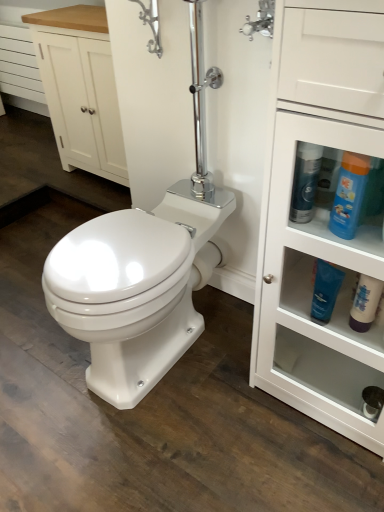
Question: From a real-world perspective, is white wood cabinet at upper left on white wood drawer at upper left?

Choices:
 (A) yes
 (B) no

Answer: (A)

Question: Is white wood cabinet at upper left further to the viewer compared to white wood drawer at upper left?

Choices:
 (A) yes
 (B) no

Answer: (B)

Question: Is white wood cabinet at upper left thinner than white wood drawer at upper left?

Choices:
 (A) no
 (B) yes

Answer: (A)

Question: Is white wood cabinet at upper left far away from white wood drawer at upper left?

Choices:
 (A) yes
 (B) no

Answer: (B)

Question: Considering the relative sizes of white wood cabinet at upper left and white wood drawer at upper left in the image provided, is white wood cabinet at upper left wider than white wood drawer at upper left?

Choices:
 (A) no
 (B) yes

Answer: (B)

Question: Relative to white wood drawer at upper left, is blue glossy tube at lower right, acting as the 2th cleaning product starting from the left, in front or behind?

Choices:
 (A) behind
 (B) front

Answer: (B)

Question: Is blue glossy tube at lower right, the third cleaning product viewed from the right, wider or thinner than white wood drawer at upper left?

Choices:
 (A) wide
 (B) thin

Answer: (B)

Question: Based on their positions, is blue glossy tube at lower right, the third cleaning product viewed from the right, located to the left or right of white wood drawer at upper left?

Choices:
 (A) right
 (B) left

Answer: (A)

Question: From a real-world perspective, is blue glossy tube at lower right, the third cleaning product viewed from the right, physically located above or below white wood drawer at upper left?

Choices:
 (A) above
 (B) below

Answer: (A)

Question: Considering their positions, is white glossy cabinet at right located in front of or behind white matte bottle at lower right, the 4th cleaning product positioned from the left?

Choices:
 (A) front
 (B) behind

Answer: (A)

Question: Considering the relative positions of white glossy cabinet at right and white matte bottle at lower right, which is the first cleaning product from right to left, in the image provided, is white glossy cabinet at right to the left or to the right of white matte bottle at lower right, which is the first cleaning product from right to left,?

Choices:
 (A) left
 (B) right

Answer: (B)

Question: From a real-world perspective, is white glossy cabinet at right above or below white matte bottle at lower right, which is the first cleaning product from right to left?

Choices:
 (A) above
 (B) below

Answer: (A)

Question: Considering the positions of white glossy cabinet at right and white matte bottle at lower right, which is the first cleaning product from right to left, in the image, is white glossy cabinet at right bigger or smaller than white matte bottle at lower right, which is the first cleaning product from right to left,?

Choices:
 (A) big
 (B) small

Answer: (A)

Question: Is blue glossy bottle at right, which is counted as the fourth cleaning product, starting from the right, to the left or to the right of blue plastic bottle at upper right, the second cleaning product when ordered from right to left, in the image?

Choices:
 (A) right
 (B) left

Answer: (B)

Question: In terms of height, does blue glossy bottle at right, which is counted as the 1th cleaning product, starting from the left, look taller or shorter compared to blue plastic bottle at upper right, the second cleaning product when ordered from right to left?

Choices:
 (A) short
 (B) tall

Answer: (B)